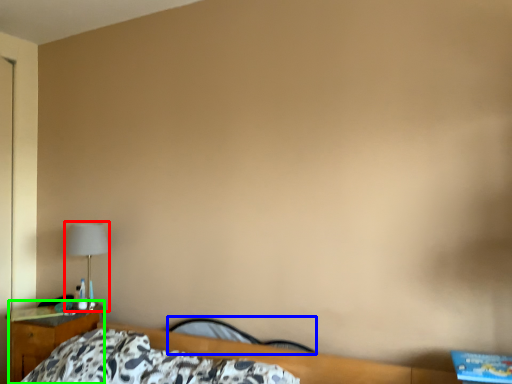
Question: Estimate the real-world distances between objects in this image. Which object is closer to lamp (highlighted by a red box), chair (highlighted by a blue box) or nightstand (highlighted by a green box)?

Choices:
 (A) chair
 (B) nightstand

Answer: (B)